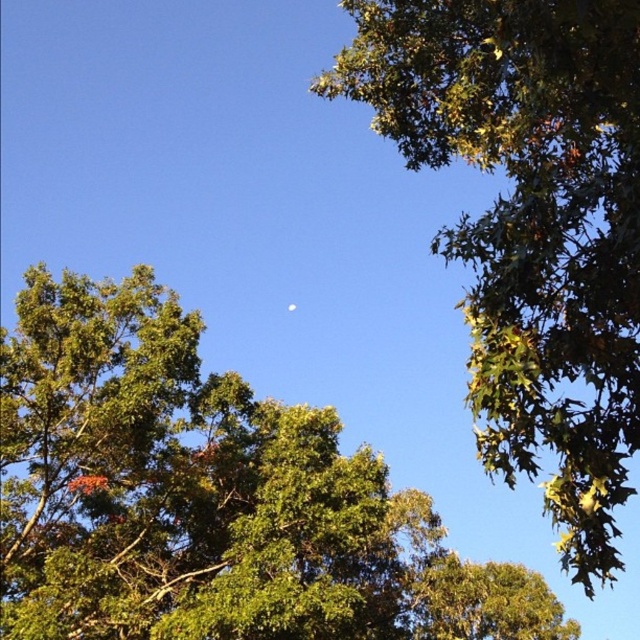
Image resolution: width=640 pixels, height=640 pixels. What do you see at coordinates (208, 497) in the screenshot? I see `green leafy tree at center` at bounding box center [208, 497].

Does point (33, 374) lie behind point (518, 259)?

Yes, point (33, 374) is behind point (518, 259).

Locate an element on the screen. green leafy tree at center is located at coordinates (208, 497).

Who is more distant from viewer, (604, 230) or (292, 310)?

Point (292, 310)

Is green leafy tree at upper right to the right of white glossy moon at center from the viewer's perspective?

Indeed, green leafy tree at upper right is positioned on the right side of white glossy moon at center.

Locate an element on the screen. green leafy tree at upper right is located at coordinates (529, 225).

Measure the distance between green leafy tree at center and white glossy moon at center.

green leafy tree at center and white glossy moon at center are 14.03 meters apart from each other.

Is green leafy tree at center closer to the viewer compared to white glossy moon at center?

Yes.

Does point (26, 424) come in front of point (289, 310)?

Yes, point (26, 424) is closer to viewer.

You are a GUI agent. You are given a task and a screenshot of the screen. Output one action in this format:
    pyautogui.click(x=<x>, y=<y>)
    Task: Click on the green leafy tree at center
    The image size is (640, 640).
    Given the screenshot: What is the action you would take?
    pyautogui.click(x=208, y=497)